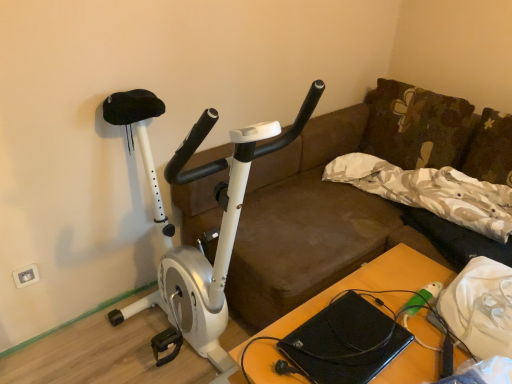
Question: From a real-world perspective, is white plastic electric outlet at lower left physically located above or below white matte stationary bicycle at left?

Choices:
 (A) below
 (B) above

Answer: (A)

Question: From the image's perspective, is white plastic electric outlet at lower left located above or below white matte stationary bicycle at left?

Choices:
 (A) below
 (B) above

Answer: (A)

Question: Based on their relative distances, which object is nearer to the beige floral fabric pillow at upper right, placed as the 2th pillow when sorted from top to bottom?

Choices:
 (A) black matte laptop at lower center
 (B) floral fabric pillow at upper right, which is the first pillow in top-to-bottom order
 (C) white plastic electric outlet at lower left
 (D) white matte stationary bicycle at left
 (E) wooden table at center

Answer: (B)

Question: Which is farther from the black matte laptop at lower center?

Choices:
 (A) white plastic electric outlet at lower left
 (B) wooden table at center
 (C) beige floral fabric pillow at upper right, the first pillow positioned from the bottom
 (D) white matte stationary bicycle at left
 (E) floral fabric pillow at upper right, which is the first pillow in top-to-bottom order

Answer: (A)